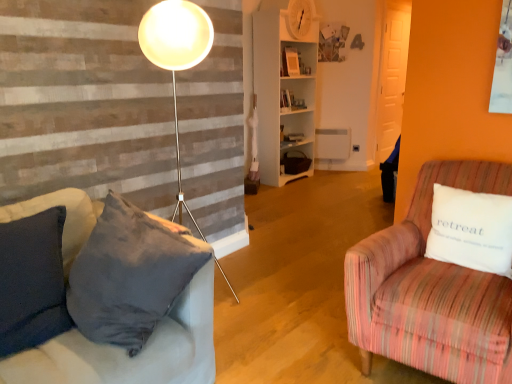
This screenshot has height=384, width=512. In order to click on white wooden shelf at center in this screenshot , I will do `click(284, 95)`.

What are the coordinates of `striped fabric armchair at right` in the screenshot? It's located at click(x=431, y=291).

Locate an element on the screen. white cotton pillow at right is located at coordinates (471, 230).

Based on the photo, is striped fabric armchair at right a part of white wooden shelf at center?

Actually, striped fabric armchair at right is outside white wooden shelf at center.

From a real-world perspective, is white wooden shelf at center on top of striped fabric armchair at right?

Yes, from a real-world perspective, white wooden shelf at center is on top of striped fabric armchair at right.

Between white wooden shelf at center and striped fabric armchair at right, which one is positioned in front?

striped fabric armchair at right is in front.

In the image, there is a white cotton pillow at right. At what (x,y) coordinates should I click in order to perform the action: click on shelf above it (from the image's perspective). Please return your answer as a coordinate pair (x, y). Looking at the image, I should click on 284,95.

Considering the positions of points (279, 155) and (440, 239), is point (279, 155) farther from camera compared to point (440, 239)?

Yes, it is behind point (440, 239).

From the image's perspective, between white wooden shelf at center and white cotton pillow at right, who is located below?

From the image's view, white cotton pillow at right is below.

Does white wooden shelf at center appear on the right side of white cotton pillow at right?

In fact, white wooden shelf at center is to the left of white cotton pillow at right.

Considering the sizes of objects striped fabric armchair at right and white cotton pillow at right in the image provided, who is bigger, striped fabric armchair at right or white cotton pillow at right?

striped fabric armchair at right is bigger.

Locate an element on the screen. studio couch lying in front of the white cotton pillow at right is located at coordinates (431, 291).

Who is taller, striped fabric armchair at right or white cotton pillow at right?

With more height is striped fabric armchair at right.

Is striped fabric armchair at right in front of white cotton pillow at right?

That is True.

How many degrees apart are the facing directions of striped fabric armchair at right and white wooden shelf at center?

striped fabric armchair at right and white wooden shelf at center are facing 86 degrees away from each other.

Image resolution: width=512 pixels, height=384 pixels. I want to click on studio couch lying below the white wooden shelf at center (from the image's perspective), so [431, 291].

Which object is further away from the camera taking this photo, striped fabric armchair at right or white wooden shelf at center?

white wooden shelf at center is behind.

Does point (435, 163) appear closer or farther from the camera than point (285, 111)?

Point (435, 163) is positioned closer to the camera compared to point (285, 111).

From the image's perspective, between white cotton pillow at right and striped fabric armchair at right, who is located below?

striped fabric armchair at right appears lower in the image.

How different are the orientations of white cotton pillow at right and striped fabric armchair at right in degrees?

There is a 0.0115-degree angle between the facing directions of white cotton pillow at right and striped fabric armchair at right.

Is the position of white cotton pillow at right more distant than that of striped fabric armchair at right?

That is True.

Who is shorter, white cotton pillow at right or striped fabric armchair at right?

With less height is white cotton pillow at right.

Is white cotton pillow at right inside the boundaries of white wooden shelf at center, or outside?

white cotton pillow at right is not inside white wooden shelf at center, it's outside.

From a real-world perspective, who is located lower, white cotton pillow at right or white wooden shelf at center?

From a 3D spatial view, white cotton pillow at right is below.

Is white cotton pillow at right positioned in front of white wooden shelf at center?

Yes, white cotton pillow at right is closer to the camera.

Which is nearer, [446,209] or [275,158]?

Point [446,209] is closer to the camera than point [275,158].

Where is `studio couch that appears on the right of white wooden shelf at center`? studio couch that appears on the right of white wooden shelf at center is located at coordinates (431, 291).

At what (x,y) coordinates should I click in order to perform the action: click on shelf behind the white cotton pillow at right. Please return your answer as a coordinate pair (x, y). Looking at the image, I should click on (284, 95).

From the image, which object appears to be farther from white cotton pillow at right, striped fabric armchair at right or white wooden shelf at center?

white wooden shelf at center is further to white cotton pillow at right.

Looking at this image, when comparing their distances from striped fabric armchair at right, does white wooden shelf at center or white cotton pillow at right seem closer?

white cotton pillow at right.

Considering their positions, is white cotton pillow at right positioned further to white wooden shelf at center than striped fabric armchair at right?

white cotton pillow at right lies further to white wooden shelf at center than the other object.

When comparing their distances from white cotton pillow at right, does white wooden shelf at center or striped fabric armchair at right seem closer?

striped fabric armchair at right lies closer to white cotton pillow at right than the other object.

Looking at this image, estimate the real-world distances between objects in this image. Which object is closer to white wooden shelf at center, striped fabric armchair at right or white cotton pillow at right?

striped fabric armchair at right is positioned closer to the anchor white wooden shelf at center.

Estimate the real-world distances between objects in this image. Which object is further from striped fabric armchair at right, white cotton pillow at right or white wooden shelf at center?

white wooden shelf at center is further to striped fabric armchair at right.

Where is `pillow between striped fabric armchair at right and white wooden shelf at center in the front-back direction`? pillow between striped fabric armchair at right and white wooden shelf at center in the front-back direction is located at coordinates 471,230.